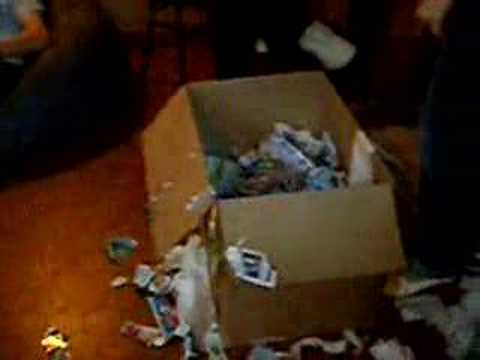
The width and height of the screenshot is (480, 360). I want to click on floor area, so click(x=71, y=236).